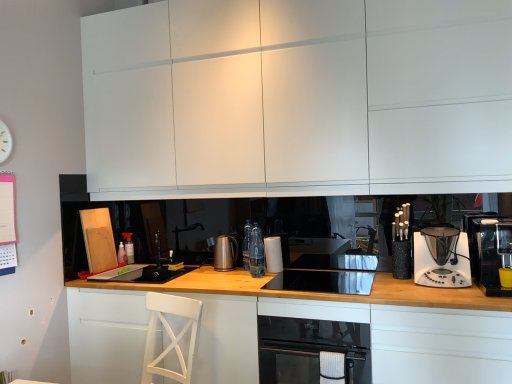
Where is `free space in front of satin silver kettle at center, which is the third kitchen appliance in right-to-left order`? free space in front of satin silver kettle at center, which is the third kitchen appliance in right-to-left order is located at coordinates (219, 271).